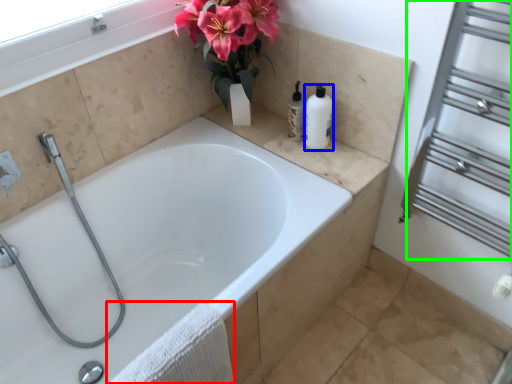
Question: Considering the real-world distances, which object is closest to bath towel (highlighted by a red box)? soap dispenser (highlighted by a blue box) or screen door (highlighted by a green box).

Choices:
 (A) soap dispenser
 (B) screen door

Answer: (A)